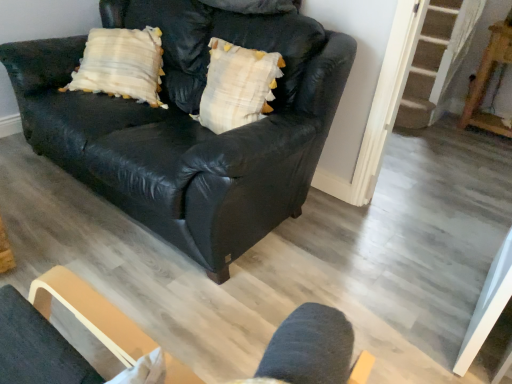
Question: From a real-world perspective, is black leather couch at center positioned under wooden table at right based on gravity?

Choices:
 (A) no
 (B) yes

Answer: (A)

Question: Is black leather couch at center looking in the opposite direction of wooden table at right?

Choices:
 (A) no
 (B) yes

Answer: (B)

Question: Considering the relative sizes of black leather couch at center and wooden table at right in the image provided, is black leather couch at center shorter than wooden table at right?

Choices:
 (A) no
 (B) yes

Answer: (A)

Question: From the image's perspective, is black leather couch at center over wooden table at right?

Choices:
 (A) yes
 (B) no

Answer: (B)

Question: Is black leather couch at center positioned behind wooden table at right?

Choices:
 (A) yes
 (B) no

Answer: (B)

Question: Is black leather couch at center thinner than wooden table at right?

Choices:
 (A) no
 (B) yes

Answer: (A)

Question: Are white textured pillow at center and wooden table at right making contact?

Choices:
 (A) no
 (B) yes

Answer: (A)

Question: Can you confirm if white textured pillow at center is taller than wooden table at right?

Choices:
 (A) no
 (B) yes

Answer: (A)

Question: From the image's perspective, is white textured pillow at center on top of wooden table at right?

Choices:
 (A) yes
 (B) no

Answer: (B)

Question: Can you confirm if white textured pillow at center is thinner than wooden table at right?

Choices:
 (A) yes
 (B) no

Answer: (A)

Question: Could you tell me if white textured pillow at center is turned towards wooden table at right?

Choices:
 (A) no
 (B) yes

Answer: (A)

Question: Is white textured pillow at center not close to wooden table at right?

Choices:
 (A) yes
 (B) no

Answer: (A)

Question: Does white textured pillow at center turn towards black leather couch at center?

Choices:
 (A) yes
 (B) no

Answer: (A)